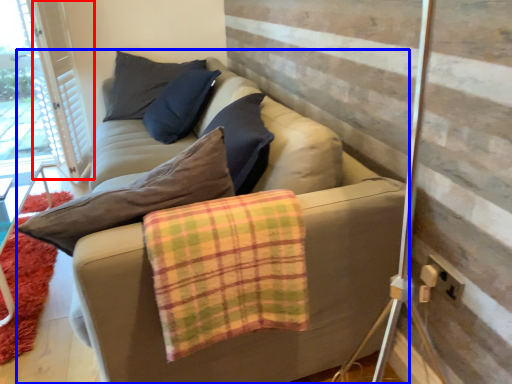
Question: Which point is further to the camera, barn door (highlighted by a red box) or studio couch (highlighted by a blue box)?

Choices:
 (A) barn door
 (B) studio couch

Answer: (A)